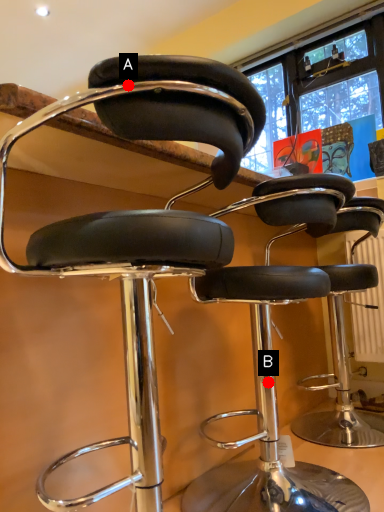
Question: Two points are circled on the image, labeled by A and B beside each circle. Which point is farther to the camera?

Choices:
 (A) A is further
 (B) B is further

Answer: (B)